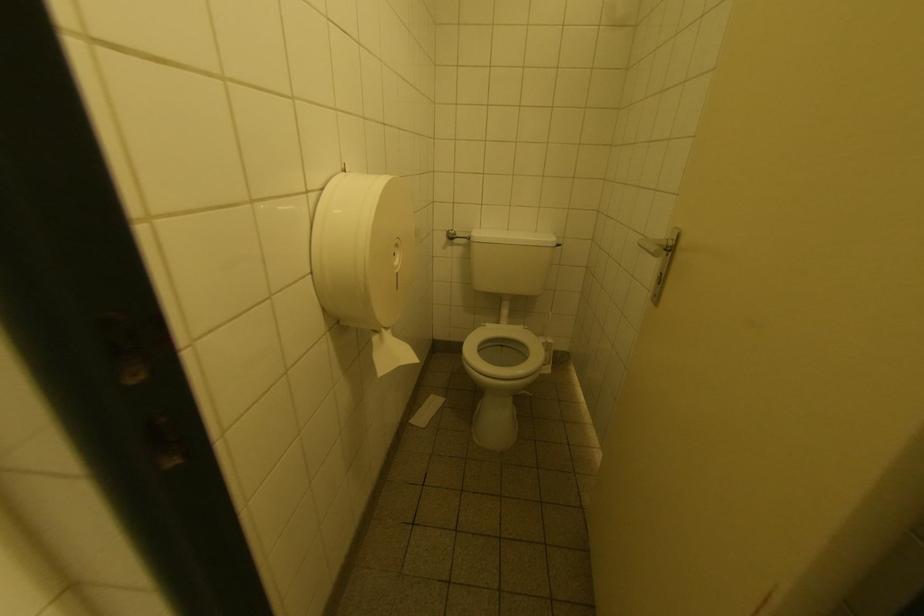
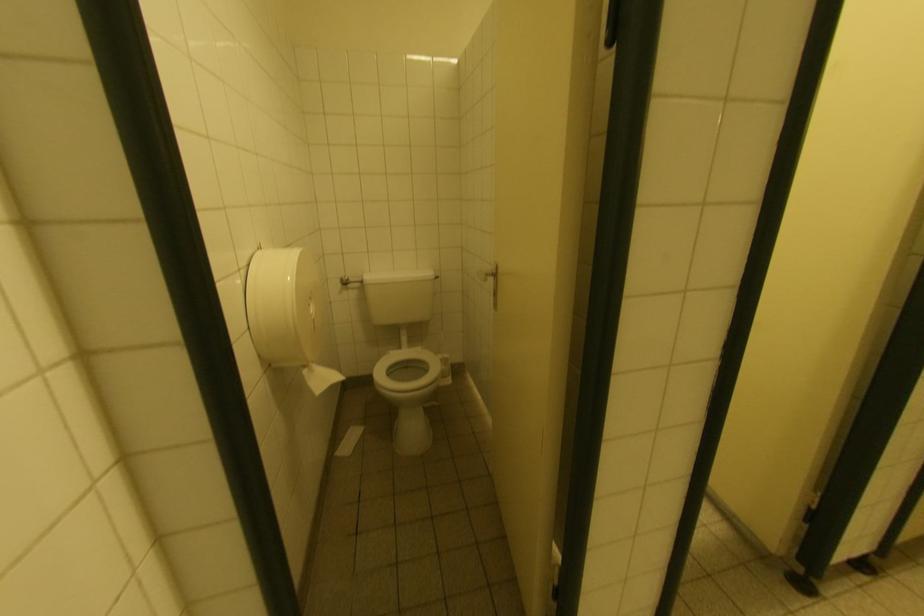
Question: The images are taken continuously from a first-person perspective. In which direction are you moving?

Choices:
 (A) Left
 (B) Right
 (C) Forward
 (D) Backward

Answer: (D)